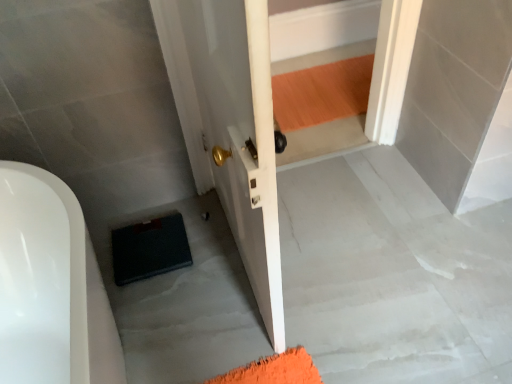
Find the location of a particular element. Image resolution: width=512 pixels, height=384 pixels. vacant area on top of black matte suitcase at lower left (from a real-world perspective) is located at coordinates (339, 263).